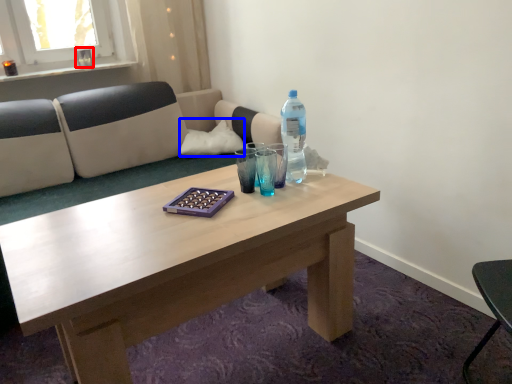
Question: Which of the following is the closest to the observer, glass vase (highlighted by a red box) or pillow (highlighted by a blue box)?

Choices:
 (A) glass vase
 (B) pillow

Answer: (B)